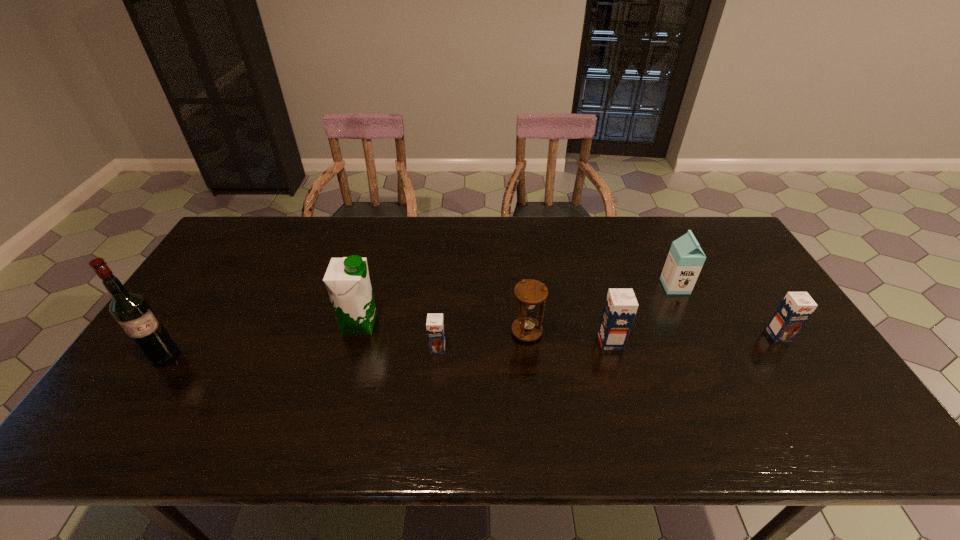
Locate an element on the screen. hourglass is located at coordinates (530, 292).

You are a GUI agent. You are given a task and a screenshot of the screen. Output one action in this format:
    pyautogui.click(x=<x>, y=<y>)
    Task: Click on the wine bottle
    
    Given the screenshot: What is the action you would take?
    pyautogui.click(x=131, y=310)

This screenshot has height=540, width=960. I want to click on the leftmost object, so click(x=131, y=310).

Identify the location of vacant space located on the front label of the shortest chocolate milk. The width and height of the screenshot is (960, 540). (434, 390).

The height and width of the screenshot is (540, 960). Identify the location of free space located 0.190m on the front label of the tallest chocolate milk. (692, 342).

You are a GUI agent. You are given a task and a screenshot of the screen. Output one action in this format:
    pyautogui.click(x=<x>, y=<y>)
    Task: Click on the free space located 0.190m on the front label of the second tallest chocolate milk
    
    Given the screenshot: What is the action you would take?
    tap(824, 404)

Find the location of a particular element. The image size is (960, 540). free space located 0.350m on the front of the farthest object is located at coordinates (727, 395).

Find the location of a particular element. The image size is (960, 540). blank area located on the front-facing side of the soya milk is located at coordinates (439, 325).

Locate an element on the screen. Image resolution: width=960 pixels, height=540 pixels. free space located on the left of the fourth object from right to left is located at coordinates (431, 332).

At what (x,y) coordinates should I click in order to perform the action: click on vacant space situated 0.090m on the front and back of the leftmost object. Please return your answer as a coordinate pair (x, y). The height and width of the screenshot is (540, 960). Looking at the image, I should click on (138, 399).